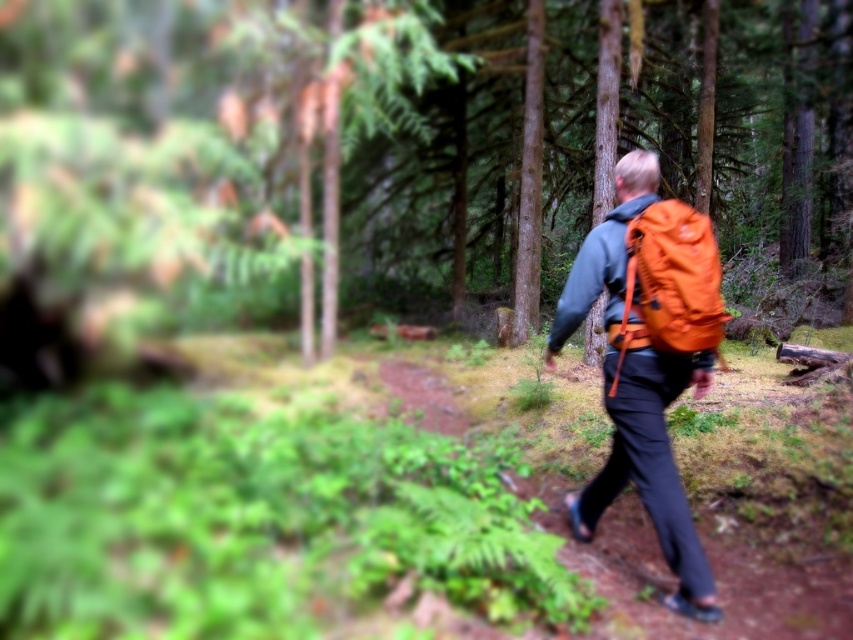
Question: Is the position of orange fabric backpack at right more distant than that of orange fabric backpack at center?

Choices:
 (A) yes
 (B) no

Answer: (B)

Question: In this image, where is orange fabric backpack at right located relative to orange fabric backpack at center?

Choices:
 (A) below
 (B) above

Answer: (B)

Question: Is green matte tree at center smaller than orange fabric backpack at upper right?

Choices:
 (A) yes
 (B) no

Answer: (B)

Question: Considering the real-world distances, which object is farthest from the orange fabric backpack at right?

Choices:
 (A) orange fabric backpack at upper right
 (B) orange fabric backpack at center

Answer: (B)

Question: Which of the following is the closest to the observer?

Choices:
 (A) (102, 97)
 (B) (618, 362)

Answer: (B)

Question: Which of the following is the closest to the observer?

Choices:
 (A) orange fabric backpack at right
 (B) green matte tree at center

Answer: (A)